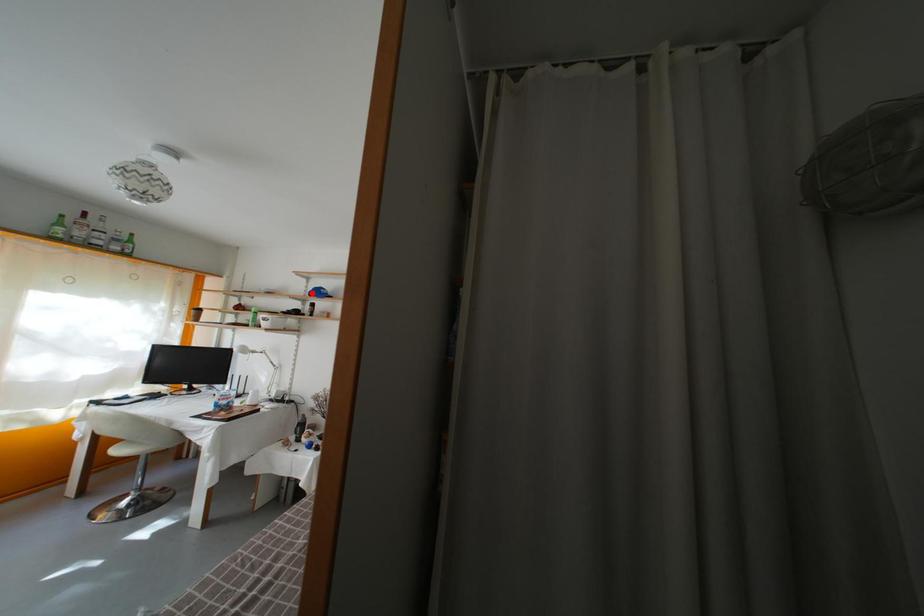
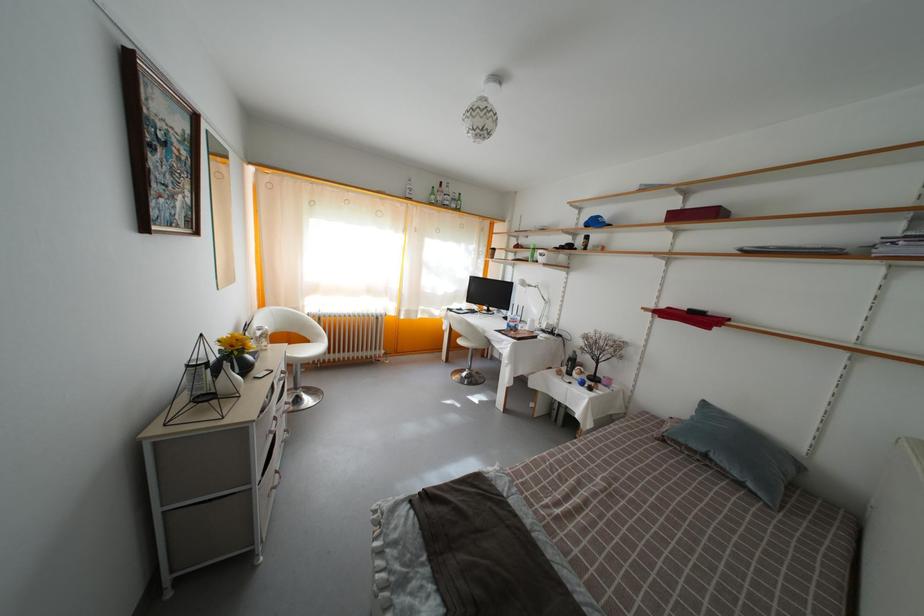
Find the pixel in the second image that matches the highlighted location in the first image.

(584, 225)